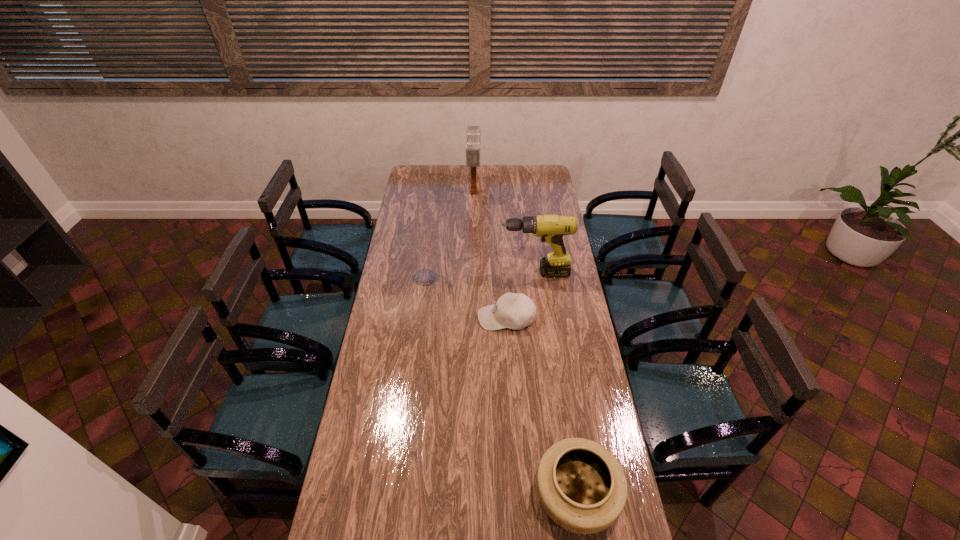
Locate an element on the screen. free space between the farthest object and the leftmost object is located at coordinates (449, 235).

Identify the location of free spot between the drill and the third tallest object. This screenshot has height=540, width=960. (480, 275).

Locate an element on the screen. Image resolution: width=960 pixels, height=540 pixels. vacant region between the farthest object and the baseball cap is located at coordinates (491, 255).

Locate an element on the screen. Image resolution: width=960 pixels, height=540 pixels. free point between the mallet and the leftmost object is located at coordinates (449, 235).

What are the coordinates of `object that is the second closest to the flute glass` in the screenshot? It's located at (551, 228).

Identify which object is located as the fourth nearest to the mallet. Please provide its 2D coordinates. Your answer should be formatted as a tuple, i.e. [(x, y)], where the tuple contains the x and y coordinates of a point satisfying the conditions above.

[(581, 485)]